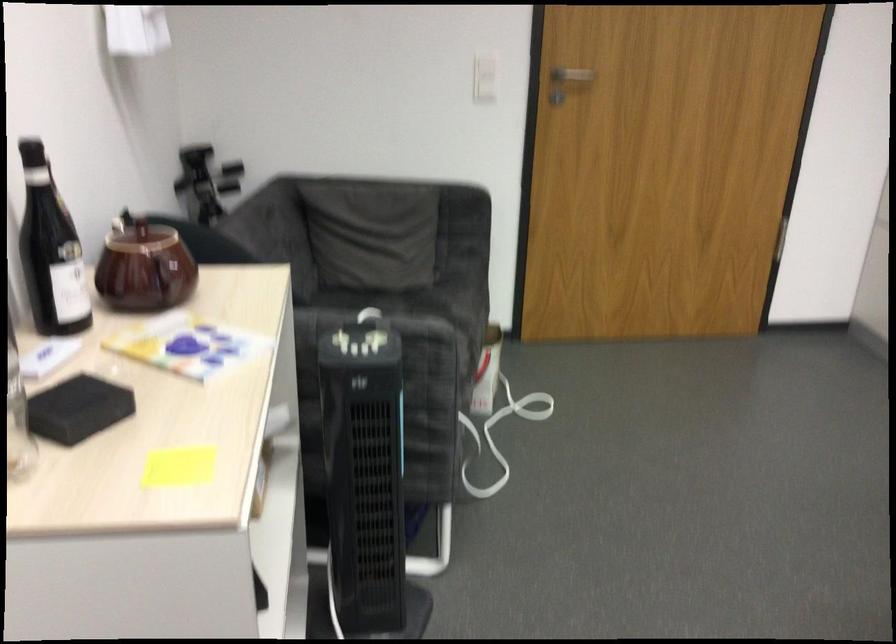
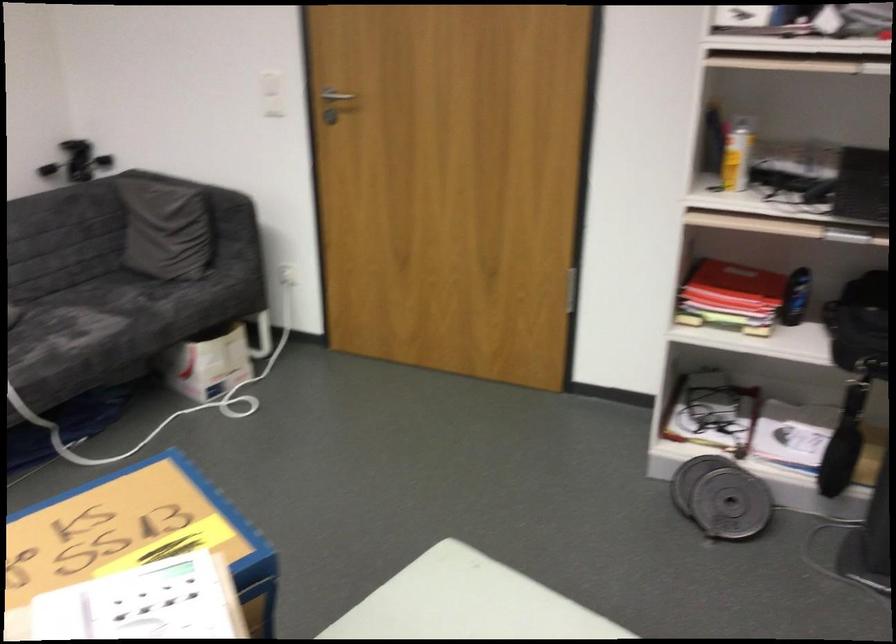
Find the pixel in the second image that matches (x=428, y=185) in the first image.

(209, 194)